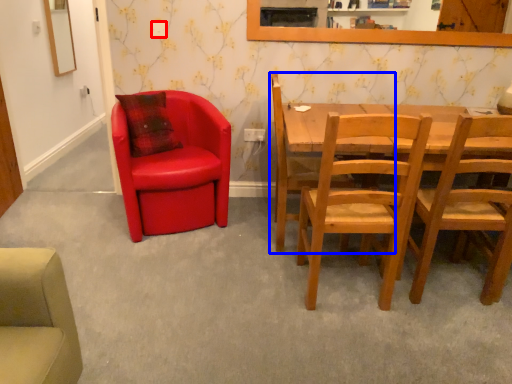
Question: Which point is further to the camera, power outlet (highlighted by a red box) or chair (highlighted by a blue box)?

Choices:
 (A) power outlet
 (B) chair

Answer: (A)